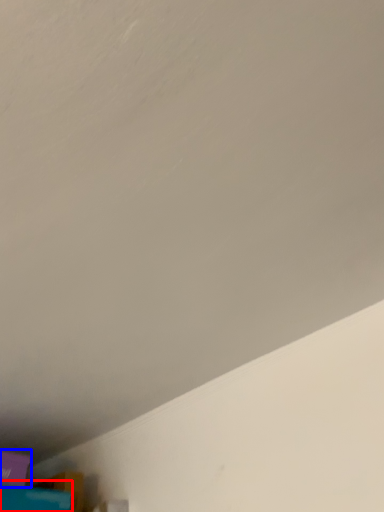
Question: Which point is closer to the camera, wide (highlighted by a red box) or box (highlighted by a blue box)?

Choices:
 (A) wide
 (B) box

Answer: (A)